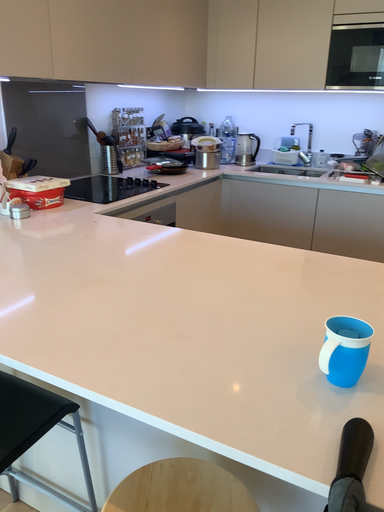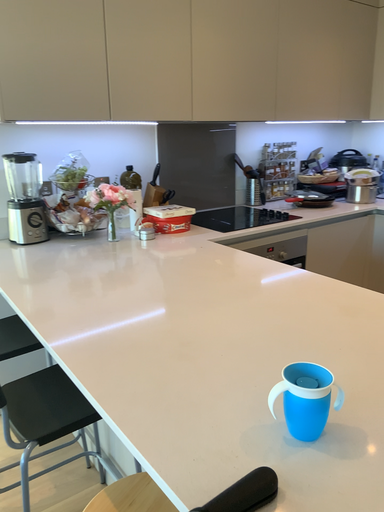
Question: Which way did the camera rotate in the video?

Choices:
 (A) rotated left
 (B) rotated right

Answer: (A)